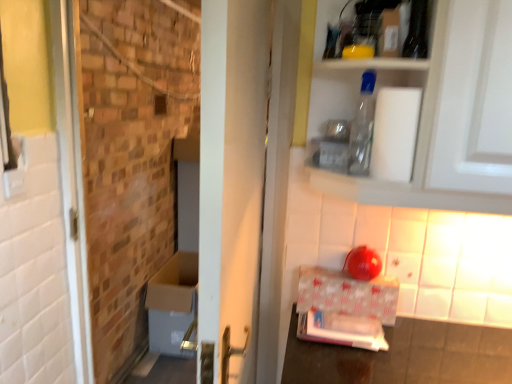
Question: From the image's perspective, is brickwork at left above white matte toilet paper at upper right?

Choices:
 (A) yes
 (B) no

Answer: (B)

Question: Are brickwork at left and white matte toilet paper at upper right located far from each other?

Choices:
 (A) no
 (B) yes

Answer: (B)

Question: Is brickwork at left in front of white matte toilet paper at upper right?

Choices:
 (A) no
 (B) yes

Answer: (A)

Question: Is brickwork at left oriented towards white matte toilet paper at upper right?

Choices:
 (A) no
 (B) yes

Answer: (A)

Question: Is brickwork at left smaller than white matte toilet paper at upper right?

Choices:
 (A) no
 (B) yes

Answer: (A)

Question: From the image's perspective, relative to white glossy cardboard box at lower right, is white matte toilet paper at upper right above or below?

Choices:
 (A) above
 (B) below

Answer: (A)

Question: Do you think white matte toilet paper at upper right is within white glossy cardboard box at lower right, or outside of it?

Choices:
 (A) outside
 (B) inside

Answer: (A)

Question: From a real-world perspective, is white matte toilet paper at upper right physically located above or below white glossy cardboard box at lower right?

Choices:
 (A) below
 (B) above

Answer: (B)

Question: Looking at their shapes, would you say white matte toilet paper at upper right is wider or thinner than white glossy cardboard box at lower right?

Choices:
 (A) thin
 (B) wide

Answer: (B)

Question: Would you say brickwork at left is to the left or to the right of white matte toilet paper at upper right in the picture?

Choices:
 (A) right
 (B) left

Answer: (B)

Question: Is point (96, 157) positioned closer to the camera than point (390, 160)?

Choices:
 (A) closer
 (B) farther

Answer: (B)

Question: From the image's perspective, is brickwork at left positioned above or below white matte toilet paper at upper right?

Choices:
 (A) below
 (B) above

Answer: (A)

Question: Looking at the image, does brickwork at left seem bigger or smaller compared to white matte toilet paper at upper right?

Choices:
 (A) small
 (B) big

Answer: (B)

Question: Is transparent plastic bottle at upper center wider or thinner than brickwork at left?

Choices:
 (A) thin
 (B) wide

Answer: (A)

Question: Considering the relative positions of transparent plastic bottle at upper center and brickwork at left in the image provided, is transparent plastic bottle at upper center to the left or to the right of brickwork at left?

Choices:
 (A) right
 (B) left

Answer: (A)